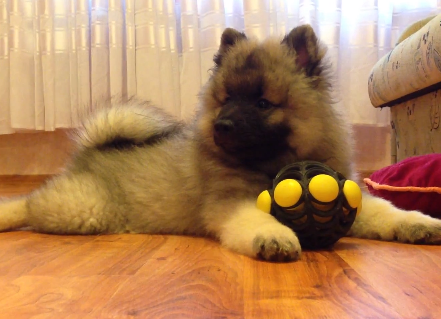
The height and width of the screenshot is (319, 441). In order to click on white curtains in this screenshot , I will do `click(188, 55)`.